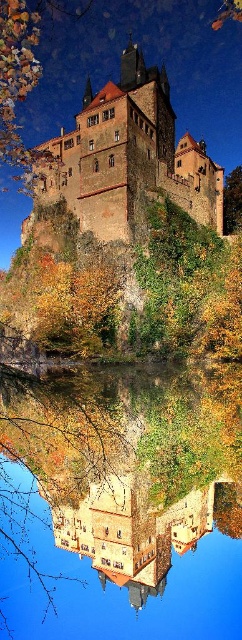
Does brown stone castle at upper center lie in front of green leafy tree at center?

Yes, it is in front of green leafy tree at center.

Who is more distant from viewer, (137,51) or (233,228)?

The point (233,228) is more distant.

Where is `brown stone castle at upper center`? brown stone castle at upper center is located at coordinates (128, 156).

I want to click on brown stone castle at upper center, so click(x=128, y=156).

Is transparent glass water at center wider than brown stone castle at upper center?

No.

Can you confirm if transparent glass water at center is shorter than brown stone castle at upper center?

Indeed, transparent glass water at center has a lesser height compared to brown stone castle at upper center.

Who is more forward, (114,496) or (129,109)?

Point (114,496) is in front.

Where is `transparent glass water at center`? transparent glass water at center is located at coordinates [x=121, y=502].

Which is in front, point (198, 589) or point (234, 196)?

Point (198, 589) is in front.

Between point (52, 497) and point (241, 204), which one is positioned behind?

Point (241, 204)

Does point (63, 545) come farther from viewer compared to point (234, 168)?

No, it is in front of (234, 168).

Where is `transparent glass water at center`? This screenshot has width=242, height=640. transparent glass water at center is located at coordinates (121, 502).